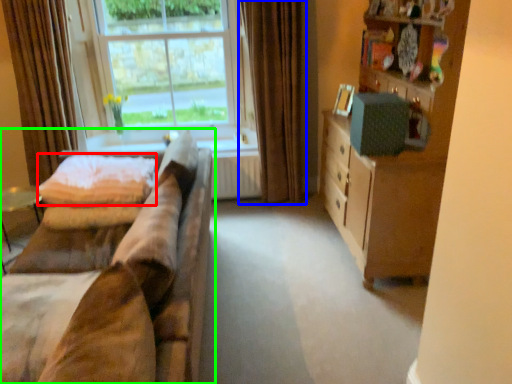
Question: Based on their relative distances, which object is nearer to quilt (highlighted by a red box)? Choose from curtain (highlighted by a blue box) and studio couch (highlighted by a green box).

Choices:
 (A) curtain
 (B) studio couch

Answer: (B)